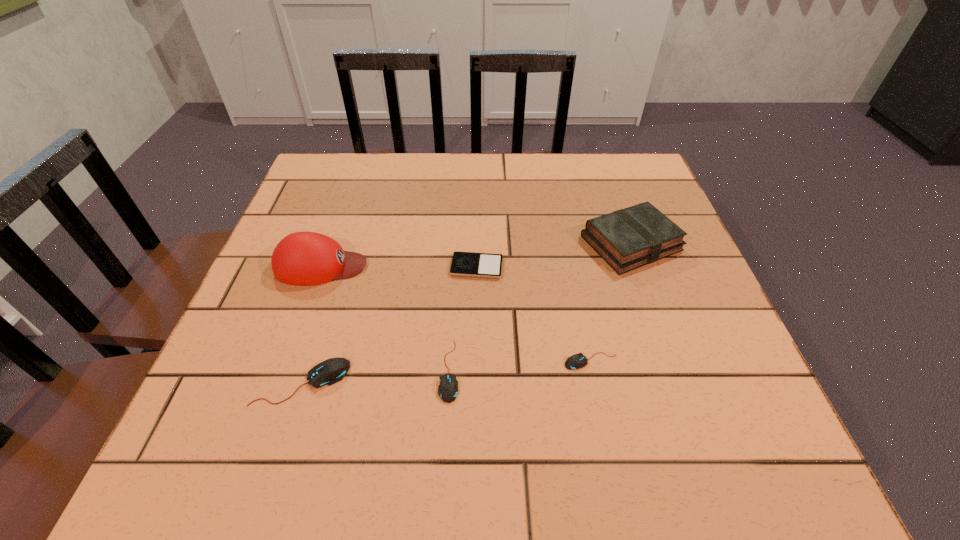
What are the coordinates of `vacant space at the near edge` in the screenshot? It's located at (345, 395).

Locate an element on the screen. The image size is (960, 540). free space at the left edge of the desktop is located at coordinates (269, 285).

You are a GUI agent. You are given a task and a screenshot of the screen. Output one action in this format:
    pyautogui.click(x=<x>, y=<y>)
    Task: Click on the blank space at the right edge of the desktop
    Image resolution: width=960 pixels, height=540 pixels.
    Given the screenshot: What is the action you would take?
    pyautogui.click(x=702, y=298)

Find the location of a particular element. Image resolution: width=960 pixels, height=540 pixels. vacant space at the far left corner of the desktop is located at coordinates (365, 165).

In the image, there is a desktop. Where is `vacant space at the near left corner`? The height and width of the screenshot is (540, 960). vacant space at the near left corner is located at coordinates (205, 387).

In the image, there is a desktop. Identify the location of vacant space at the far right corner. The height and width of the screenshot is (540, 960). (607, 183).

You are a GUI agent. You are given a task and a screenshot of the screen. Output one action in this format:
    pyautogui.click(x=<x>, y=<y>)
    Task: Click on the free point at the near right corner
    This screenshot has height=540, width=960.
    Given the screenshot: What is the action you would take?
    738,375

At what (x,y) coordinates should I click in order to perform the action: click on empty location between the book and the shortest object. Please return your answer as a coordinate pair (x, y). Looking at the image, I should click on pyautogui.click(x=554, y=255).

Where is `free space between the tallest object and the second tallest mouse`? free space between the tallest object and the second tallest mouse is located at coordinates pos(385,319).

The image size is (960, 540). I want to click on vacant area that lies between the fourth shortest object and the second tallest object, so click(467, 313).